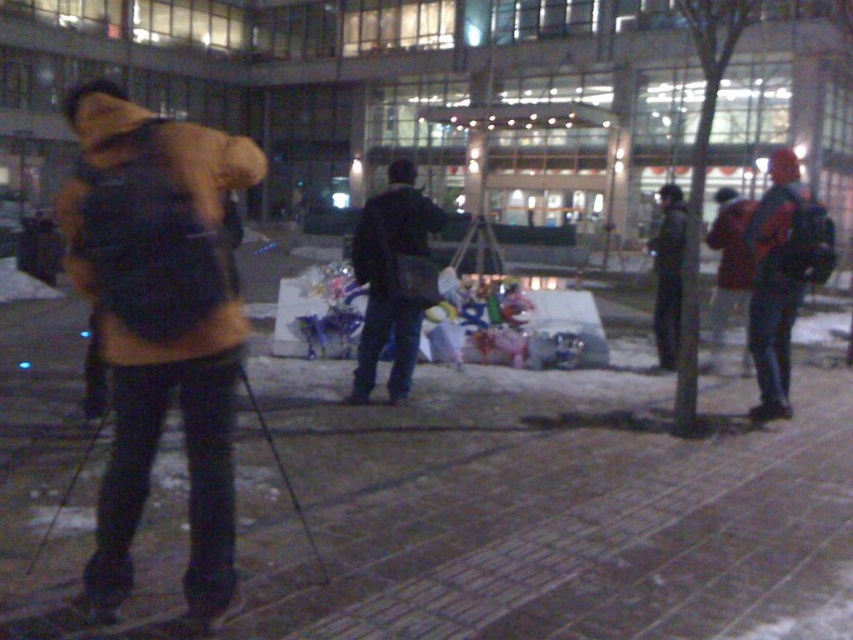
Between dark blue jeans at center and metallic ski pole at center, which one has less height?

metallic ski pole at center

Measure the distance from dark blue jeans at center to metallic ski pole at center.

3.54 meters

Which is in front, point (396, 337) or point (283, 484)?

Point (283, 484) is in front.

This screenshot has width=853, height=640. Identify the location of dark blue jeans at center. (393, 276).

Can you confirm if matte yellow jacket at left is shorter than metallic ski pole at center?

No.

Between point (161, 381) and point (292, 500), which one is positioned in front?

Positioned in front is point (161, 381).

The height and width of the screenshot is (640, 853). I want to click on matte yellow jacket at left, so click(160, 321).

Between point (70, 92) and point (363, 225), which one is positioned behind?

The point (70, 92) is more distant.

Does point (200, 564) come in front of point (366, 268)?

That is True.

Between point (119, 408) and point (376, 216), which one is positioned behind?

Point (376, 216)

Locate an element on the screen. This screenshot has width=853, height=640. matte yellow jacket at left is located at coordinates (160, 321).